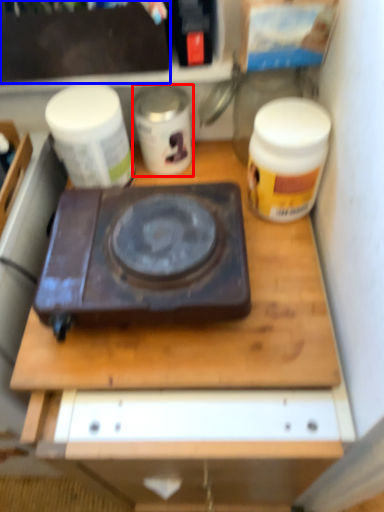
Question: Among these objects, which one is farthest to the camera, yoghurt (highlighted by a red box) or box (highlighted by a blue box)?

Choices:
 (A) yoghurt
 (B) box

Answer: (A)